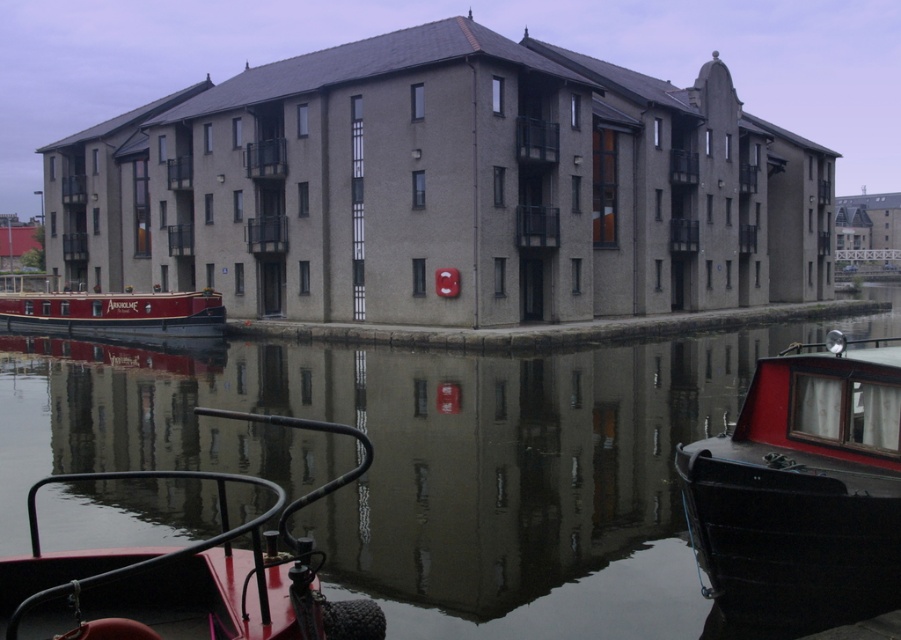
Question: Is red polished wood boat at right positioned in front of metallic red boat at lower left?

Choices:
 (A) no
 (B) yes

Answer: (A)

Question: Can you confirm if red polished wood boat at right is smaller than matte red boat at left?

Choices:
 (A) yes
 (B) no

Answer: (A)

Question: Which object is positioned closest to the matte red boat at left?

Choices:
 (A) smooth concrete canal at center
 (B) red polished wood boat at right
 (C) metallic red boat at lower left

Answer: (A)

Question: Which point appears farthest from the camera in this image?

Choices:
 (A) (895, 496)
 (B) (14, 305)

Answer: (B)

Question: Estimate the real-world distances between objects in this image. Which object is farther from the matte red boat at left?

Choices:
 (A) red polished wood boat at right
 (B) metallic red boat at lower left
 (C) smooth concrete canal at center

Answer: (A)

Question: Is red polished wood boat at right bigger than matte red boat at left?

Choices:
 (A) yes
 (B) no

Answer: (B)